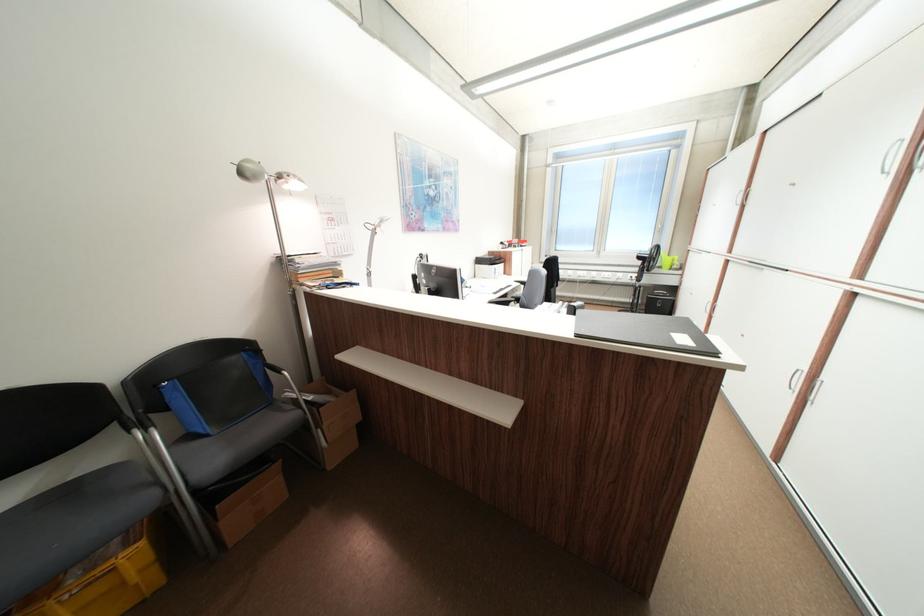
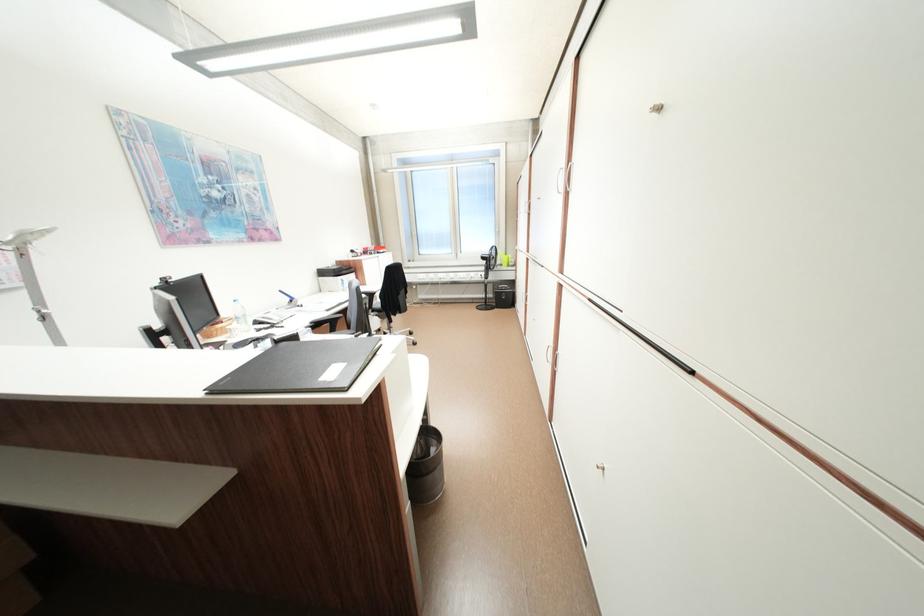
In the second image, find the point that corresponds to point (519, 275) in the first image.

(373, 285)